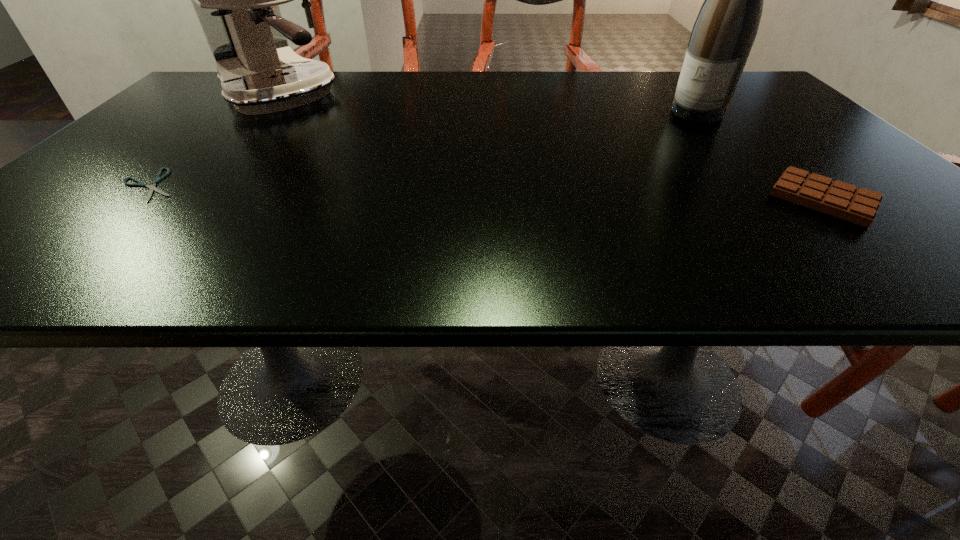
Locate an element on the screen. This screenshot has width=960, height=540. free space on the desktop that is between the shears and the candy bar and is positioned on the label of the wine bottle is located at coordinates (578, 194).

Locate an element on the screen. This screenshot has width=960, height=540. vacant space on the desktop that is between the shears and the candy bar and is positioned on the front-facing side of the coffee maker is located at coordinates (416, 191).